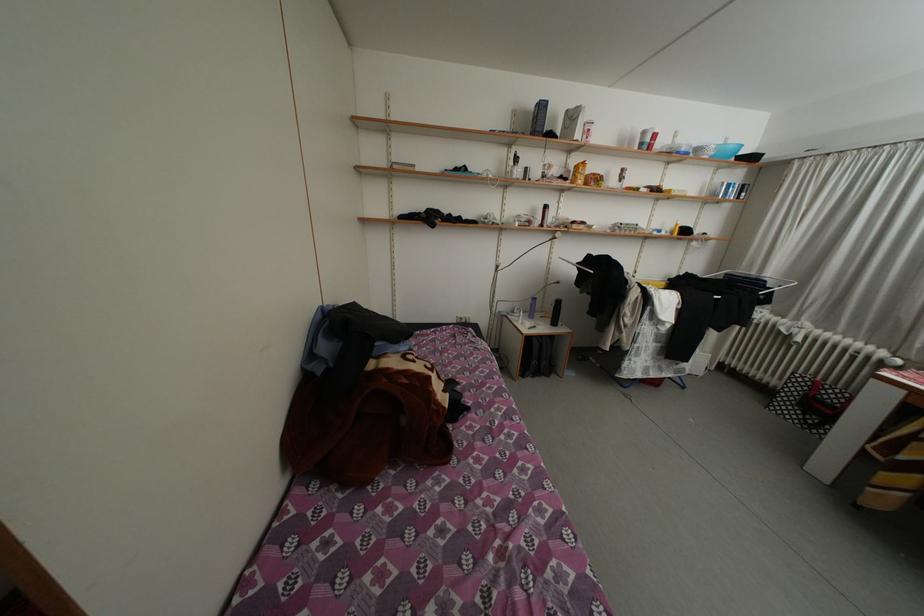
In order to click on red spray can in this screenshot , I will do `click(647, 139)`.